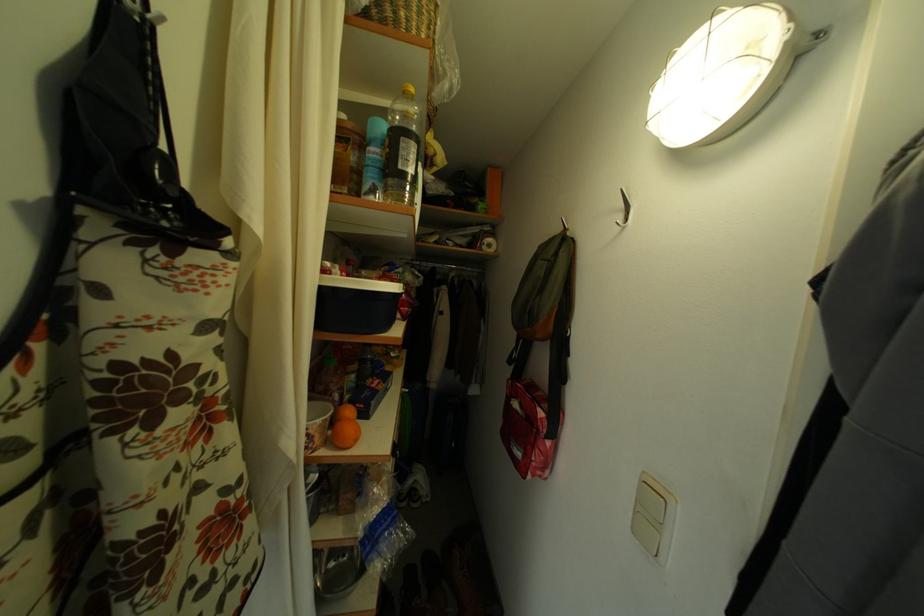
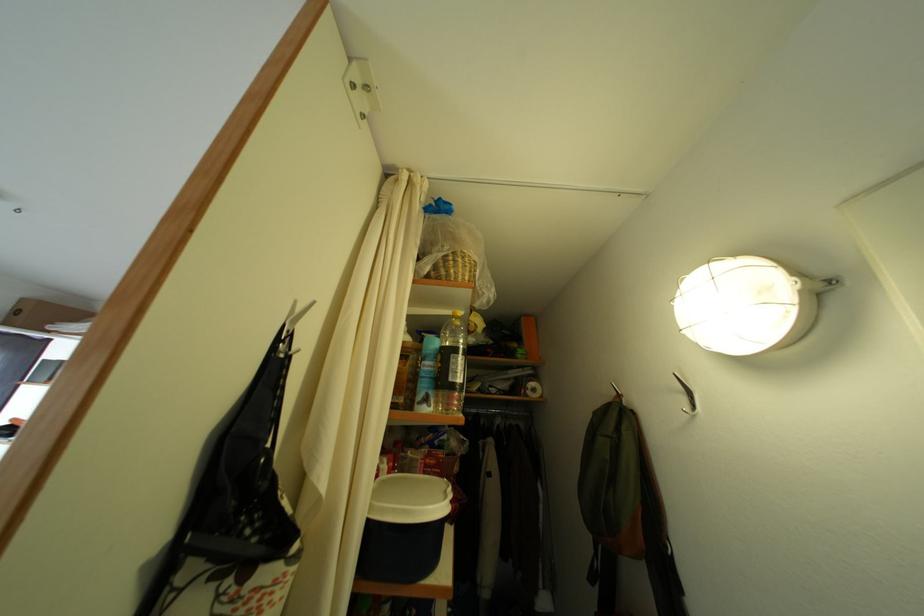
Where in the second image is the point corresponding to (346,276) from the first image?

(394, 474)